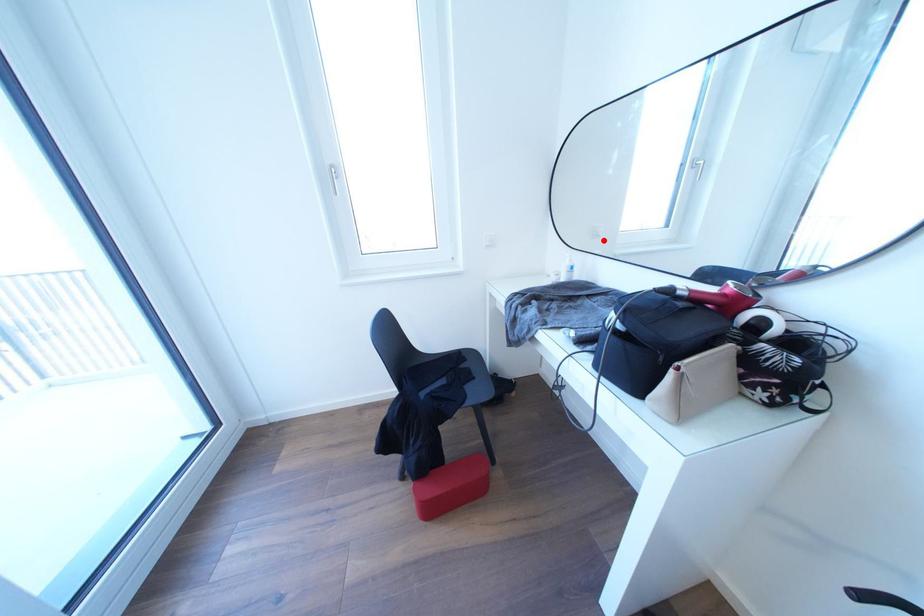
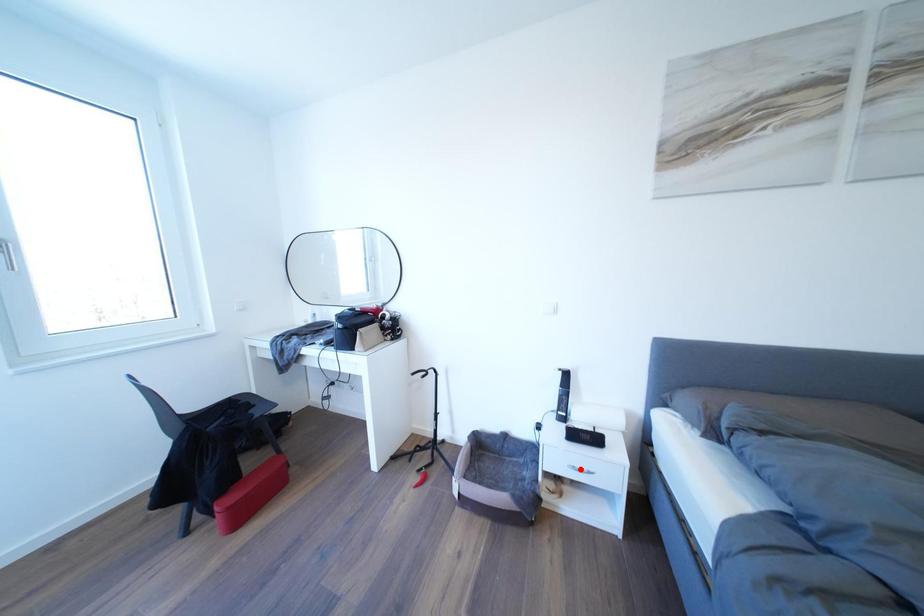
I am providing you with two images of the same scene from different viewpoints. A red point is marked on the first image and another point is marked on the second image. Does the point marked in image1 correspond to the same location as the one in image2?

No